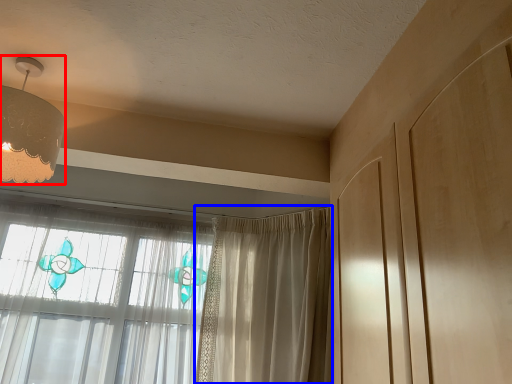
Question: Which point is further to the camera, lamp (highlighted by a red box) or curtain (highlighted by a blue box)?

Choices:
 (A) lamp
 (B) curtain

Answer: (B)